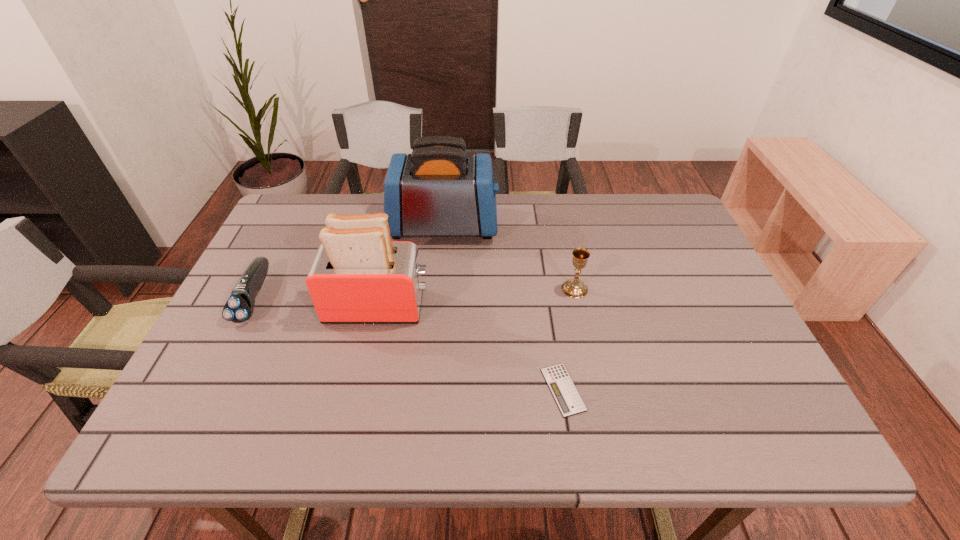
Image resolution: width=960 pixels, height=540 pixels. Find the location of `vacant area in the image that satisfies the following two spatial constraints: 1. on the front-facing side of the nearer toaster; 2. on the back side of the shortest object`. vacant area in the image that satisfies the following two spatial constraints: 1. on the front-facing side of the nearer toaster; 2. on the back side of the shortest object is located at coordinates coord(360,389).

This screenshot has height=540, width=960. In order to click on free space that satisfies the following two spatial constraints: 1. on the front-facing side of the nearer toaster; 2. on the left side of the calculator in this screenshot , I will do `click(360, 389)`.

You are a GUI agent. You are given a task and a screenshot of the screen. Output one action in this format:
    pyautogui.click(x=<x>, y=<y>)
    Task: Click on the free point that satisfies the following two spatial constraints: 1. on the front-facing side of the nearest object; 2. on the left side of the nearer toaster
    
    Given the screenshot: What is the action you would take?
    pyautogui.click(x=360, y=389)

I want to click on vacant point that satisfies the following two spatial constraints: 1. on the head of the nearest object; 2. on the left side of the electric shaver, so 208,389.

The image size is (960, 540). Identify the location of vacant position in the image that satisfies the following two spatial constraints: 1. on the front-facing side of the shortest object; 2. on the right side of the farther toaster. point(428,389).